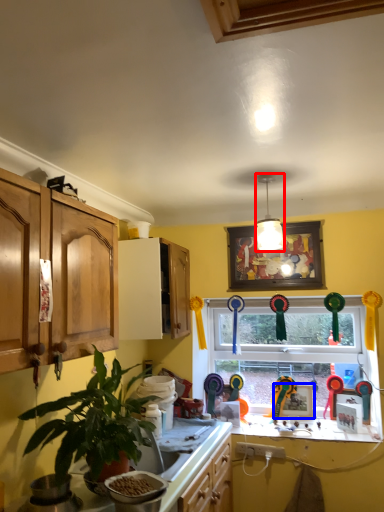
Question: Which of the following is the farthest to the observer, light fixture (highlighted by a red box) or picture frame (highlighted by a blue box)?

Choices:
 (A) light fixture
 (B) picture frame

Answer: (B)